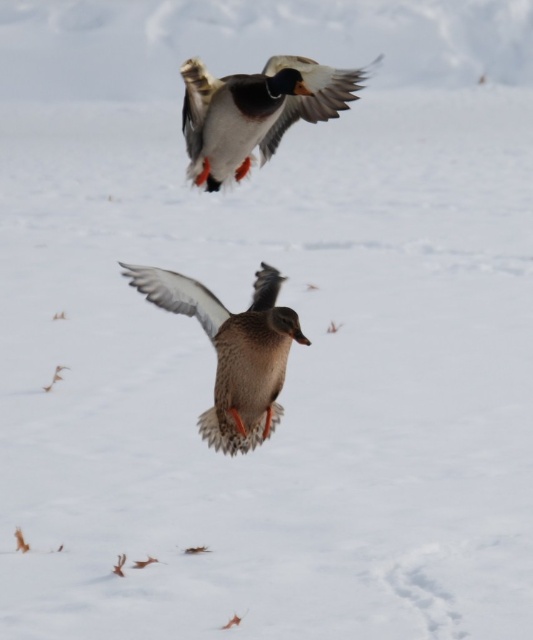
Is brown feathered duck at center thinner than speckled feathered duck at upper center?

Yes.

This screenshot has width=533, height=640. What do you see at coordinates (232, 349) in the screenshot? I see `brown feathered duck at center` at bounding box center [232, 349].

What do you see at coordinates (232, 349) in the screenshot? I see `brown feathered duck at center` at bounding box center [232, 349].

The width and height of the screenshot is (533, 640). I want to click on brown feathered duck at center, so click(x=232, y=349).